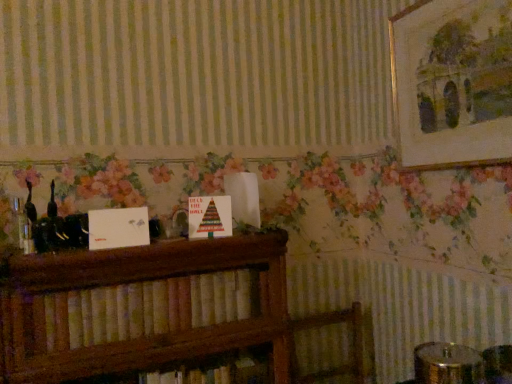
Question: Is gold-framed painting at upper right oriented away from wooden bookshelf at center?

Choices:
 (A) no
 (B) yes

Answer: (A)

Question: From the image's perspective, is gold-framed painting at upper right located above wooden bookshelf at center?

Choices:
 (A) yes
 (B) no

Answer: (A)

Question: Is gold-framed painting at upper right outside of wooden bookshelf at center?

Choices:
 (A) yes
 (B) no

Answer: (A)

Question: Is gold-framed painting at upper right shorter than wooden bookshelf at center?

Choices:
 (A) yes
 (B) no

Answer: (B)

Question: Does gold-framed painting at upper right have a greater width compared to wooden bookshelf at center?

Choices:
 (A) no
 (B) yes

Answer: (A)

Question: Is gold-framed painting at upper right thinner than wooden bookshelf at center?

Choices:
 (A) yes
 (B) no

Answer: (A)

Question: From a real-world perspective, is wooden bookshelf at center physically above gold-framed painting at upper right?

Choices:
 (A) no
 (B) yes

Answer: (A)

Question: Is wooden bookshelf at center at the right side of gold-framed painting at upper right?

Choices:
 (A) yes
 (B) no

Answer: (B)

Question: Are wooden bookshelf at center and gold-framed painting at upper right far apart?

Choices:
 (A) yes
 (B) no

Answer: (B)

Question: Considering the relative positions of wooden bookshelf at center and gold-framed painting at upper right in the image provided, is wooden bookshelf at center to the left of gold-framed painting at upper right from the viewer's perspective?

Choices:
 (A) no
 (B) yes

Answer: (B)

Question: Is wooden bookshelf at center closer to the viewer compared to gold-framed painting at upper right?

Choices:
 (A) yes
 (B) no

Answer: (A)

Question: Is wooden bookshelf at center touching gold-framed painting at upper right?

Choices:
 (A) no
 (B) yes

Answer: (A)

Question: From a real-world perspective, is gold-framed painting at upper right positioned above or below wooden bookshelf at center?

Choices:
 (A) above
 (B) below

Answer: (A)